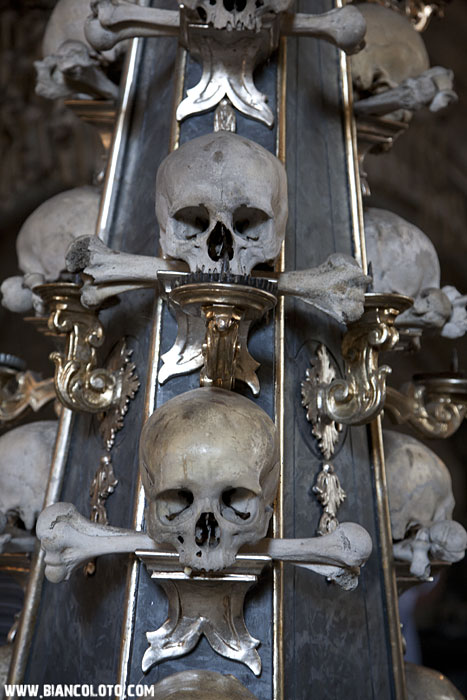
This screenshot has width=467, height=700. What are the coordinates of `shelf` in the screenshot? It's located at (213, 602), (214, 327), (32, 575), (422, 598), (422, 348), (391, 131), (229, 70), (105, 112).